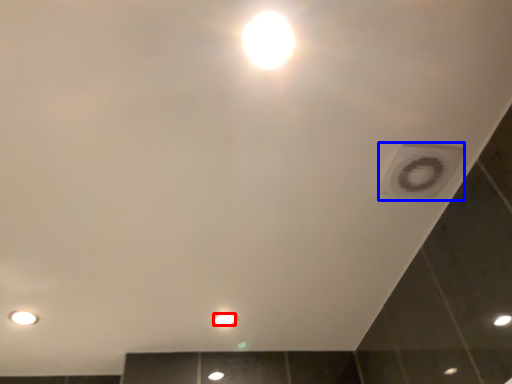
Question: Which object appears closest to the camera in this image, light bulb (highlighted by a red box) or hole (highlighted by a blue box)?

Choices:
 (A) light bulb
 (B) hole

Answer: (B)